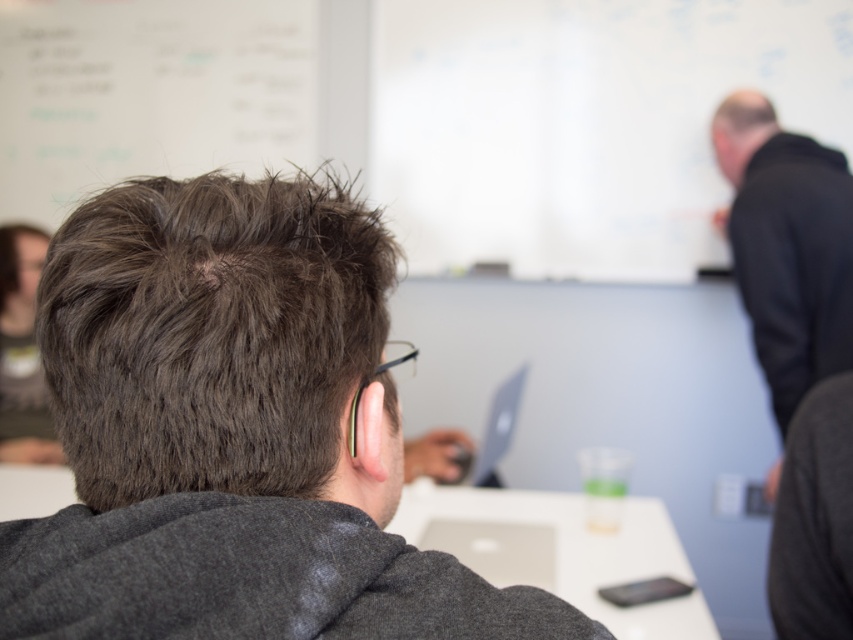
Question: Which point is farther to the camera?

Choices:
 (A) (56, 496)
 (B) (84, 628)
 (C) (762, 352)

Answer: (C)

Question: Among these objects, which one is farthest from the camera?

Choices:
 (A) white plastic table at center
 (B) black matte jacket at upper right

Answer: (B)

Question: Where is dark gray hoodie at center located in relation to white plastic table at center in the image?

Choices:
 (A) above
 (B) below

Answer: (A)

Question: Is dark gray hoodie at center smaller than black matte jacket at upper right?

Choices:
 (A) yes
 (B) no

Answer: (A)

Question: Can you confirm if dark gray hoodie at center is positioned above black matte jacket at upper right?

Choices:
 (A) no
 (B) yes

Answer: (A)

Question: Which object is farther from the camera taking this photo?

Choices:
 (A) dark gray hoodie at center
 (B) white plastic table at center

Answer: (B)